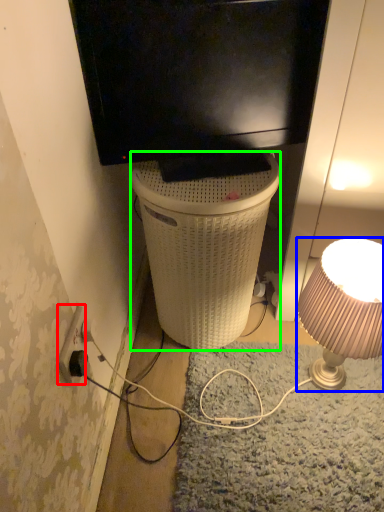
Question: Which object is the closest to the power outlet (highlighted by a red box)? Choose among these: lamp (highlighted by a blue box) or trash bin/can (highlighted by a green box).

Choices:
 (A) lamp
 (B) trash bin/can

Answer: (B)